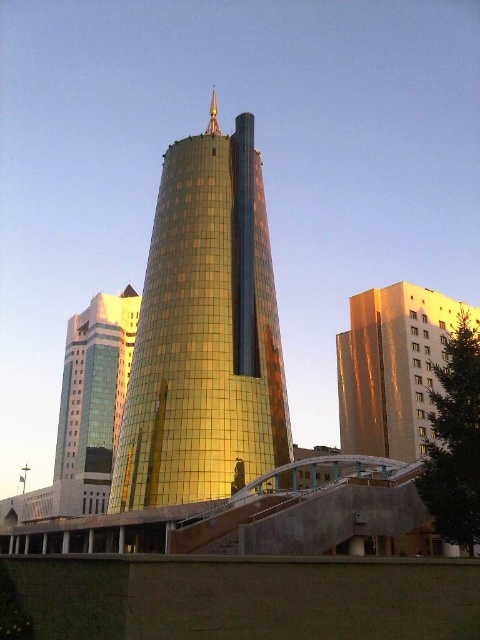
You are standing on the walkway and want to take a photo of the gold reflective tower at center and the matte glass skyscraper at left. Which building should you focus on first if you want to capture both in a single frame without moving your camera?

The gold reflective tower at center is positioned over the matte glass skyscraper at left, so you should focus on the matte glass skyscraper at left first to ensure both are in the frame.

You are standing on the walkway in front of the gold reflective tower at center and the matte glass skyscraper at left. Which building is closer to you?

The gold reflective tower at center is closer to you because it is in front of the matte glass skyscraper at left.

You are standing on the concrete walkway in front of the gold reflective building at center and the matte glass skyscraper at left. Which building is closer to your left side?

The matte glass skyscraper at left is closer to your left side because it is positioned to the left of the gold reflective building at center.